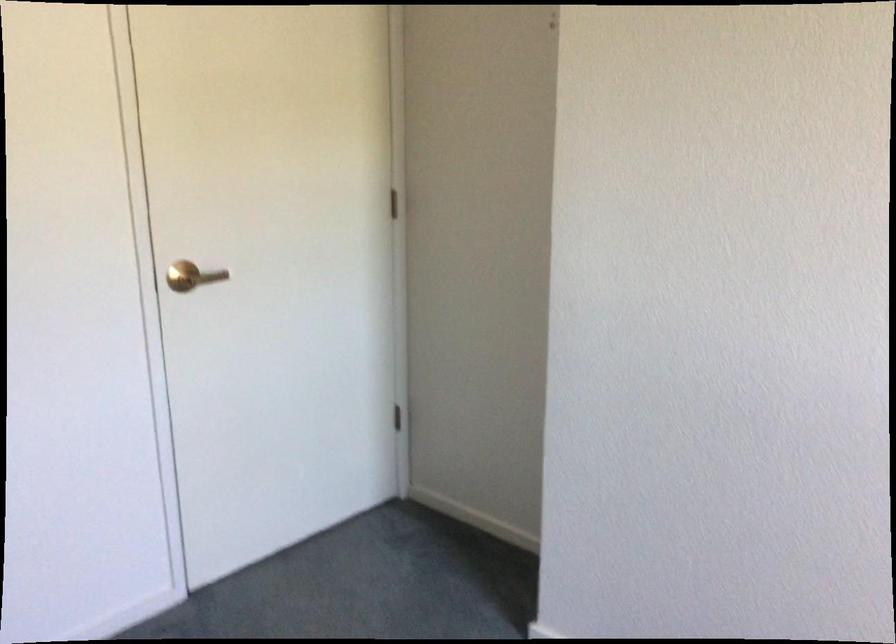
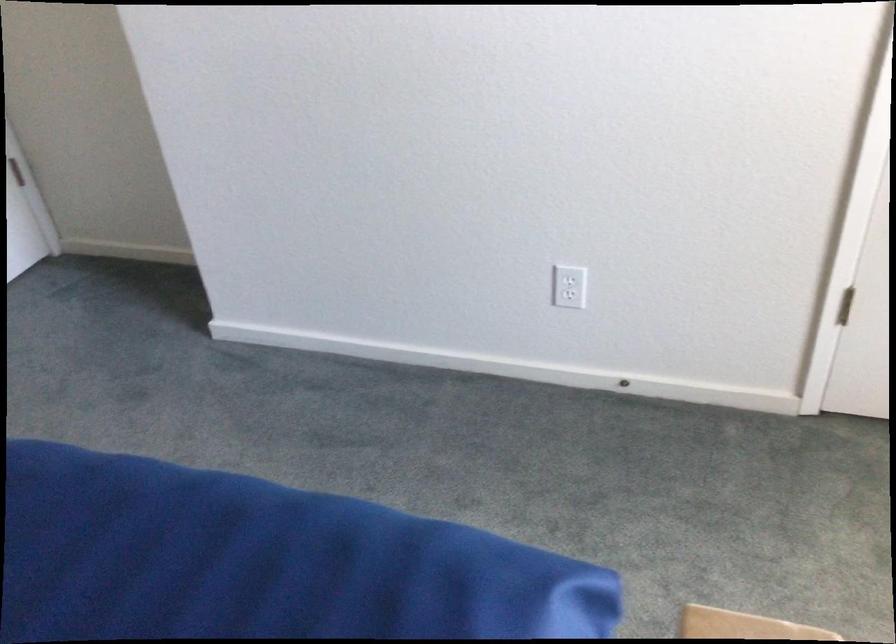
Based on the continuous images, in which direction is the camera rotating?

→ The rotation direction of the camera is right-down.